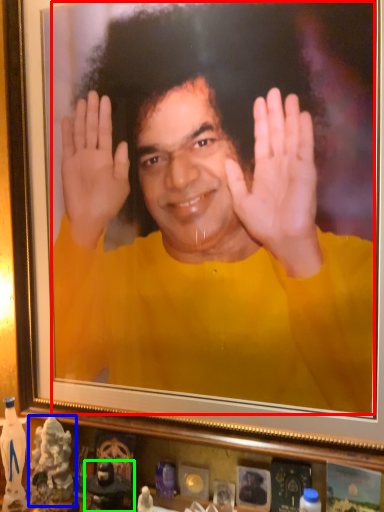
Question: Which is farther away from man (highlighted by a red box)? toy (highlighted by a blue box) or toy (highlighted by a green box)?

Choices:
 (A) toy
 (B) toy

Answer: (B)